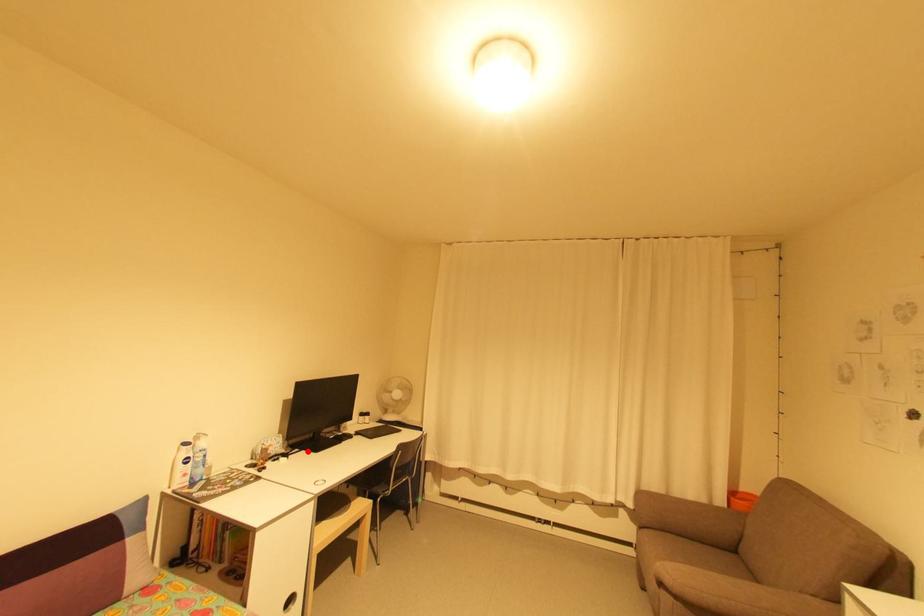
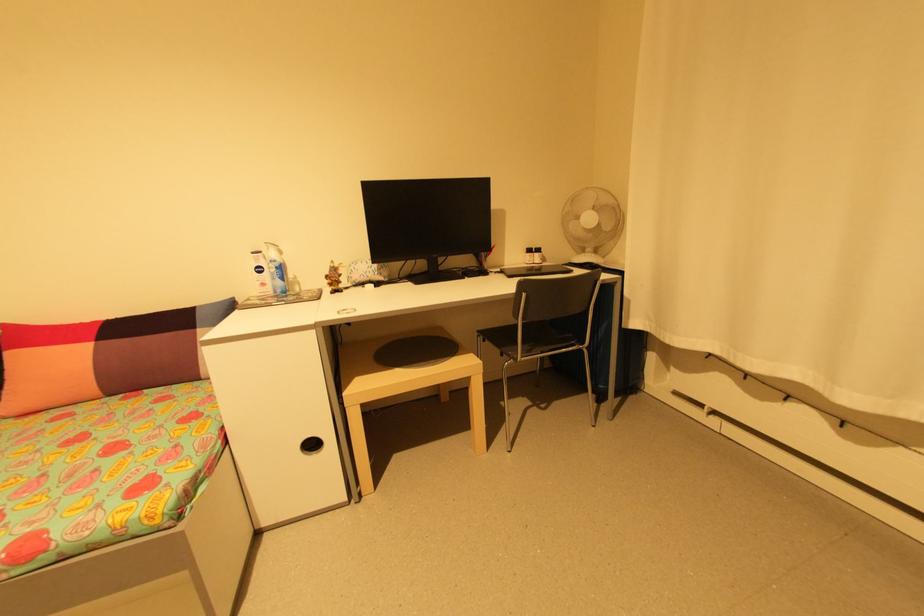
Where in the second image is the point corresponding to the highlighted location from the first image?

(414, 283)